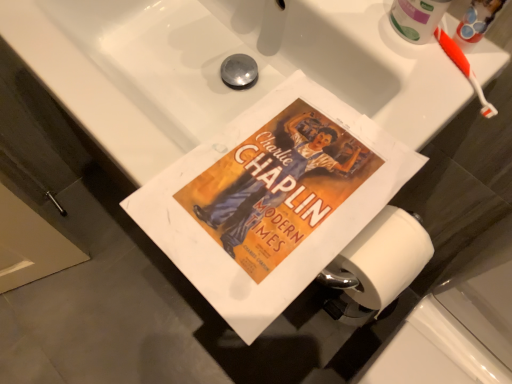
Question: From the image's perspective, is matte paper poster at center above or below orange plastic toothbrush at upper right?

Choices:
 (A) above
 (B) below

Answer: (B)

Question: Is matte paper poster at center bigger or smaller than orange plastic toothbrush at upper right?

Choices:
 (A) small
 (B) big

Answer: (B)

Question: From a real-world perspective, is matte paper poster at center positioned above or below orange plastic toothbrush at upper right?

Choices:
 (A) above
 (B) below

Answer: (B)

Question: Considering the positions of point (484, 109) and point (295, 102), is point (484, 109) closer or farther from the camera than point (295, 102)?

Choices:
 (A) closer
 (B) farther

Answer: (B)

Question: Is orange plastic toothbrush at upper right wider or thinner than matte paper poster at center?

Choices:
 (A) wide
 (B) thin

Answer: (B)

Question: In terms of size, does orange plastic toothbrush at upper right appear bigger or smaller than matte paper poster at center?

Choices:
 (A) big
 (B) small

Answer: (B)

Question: Considering the positions of orange plastic toothbrush at upper right and matte paper poster at center in the image, is orange plastic toothbrush at upper right taller or shorter than matte paper poster at center?

Choices:
 (A) short
 (B) tall

Answer: (B)